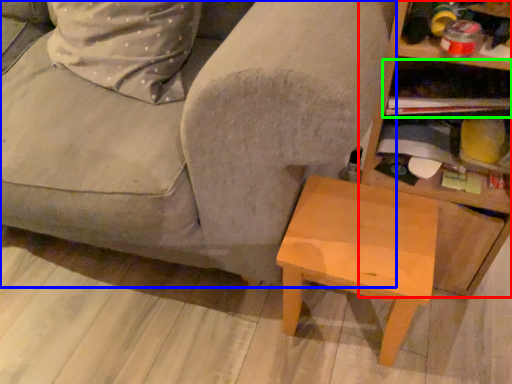
Question: Which object is positioned farthest from shelf (highlighted by a red box)? Select from studio couch (highlighted by a blue box) and shelf (highlighted by a green box).

Choices:
 (A) studio couch
 (B) shelf

Answer: (A)